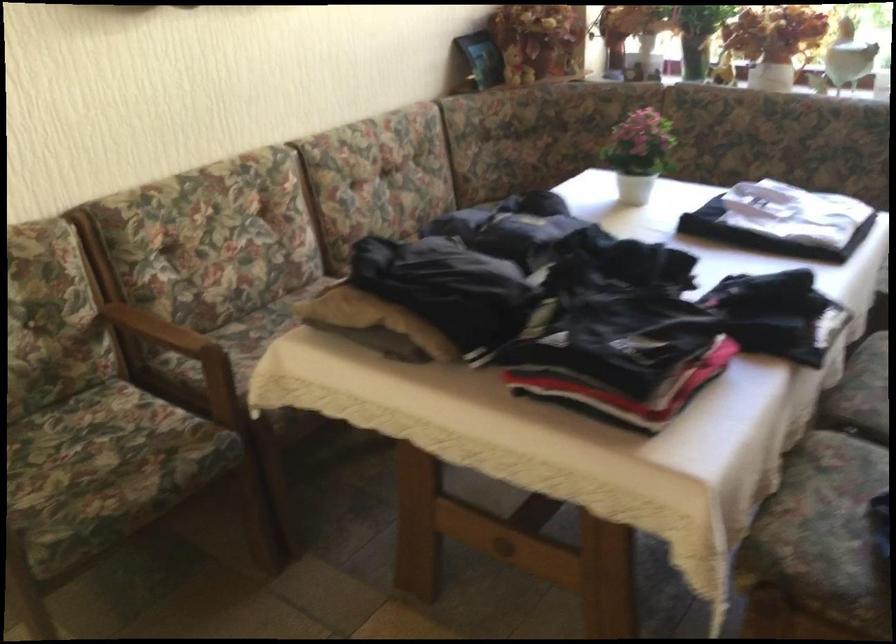
Where would you plac the brown pillow? Please return your answer as a coordinate pair (x, y).

(351, 307)